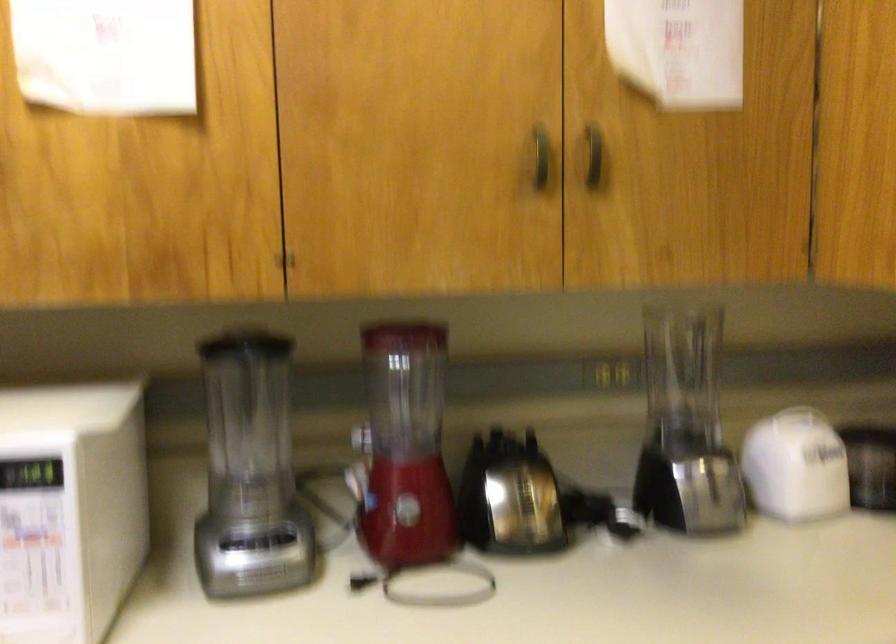
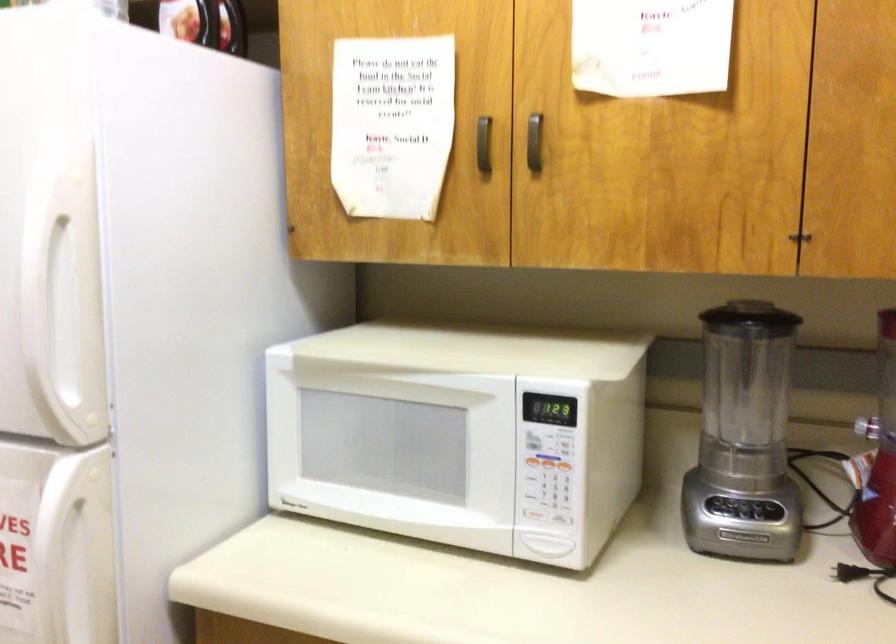
Question: The camera is either moving clockwise (left) or counter-clockwise (right) around the object. The first image is from the beginning of the video and the second image is from the end. Is the camera moving left or right when shooting the video?

Choices:
 (A) Left
 (B) Right

Answer: (B)